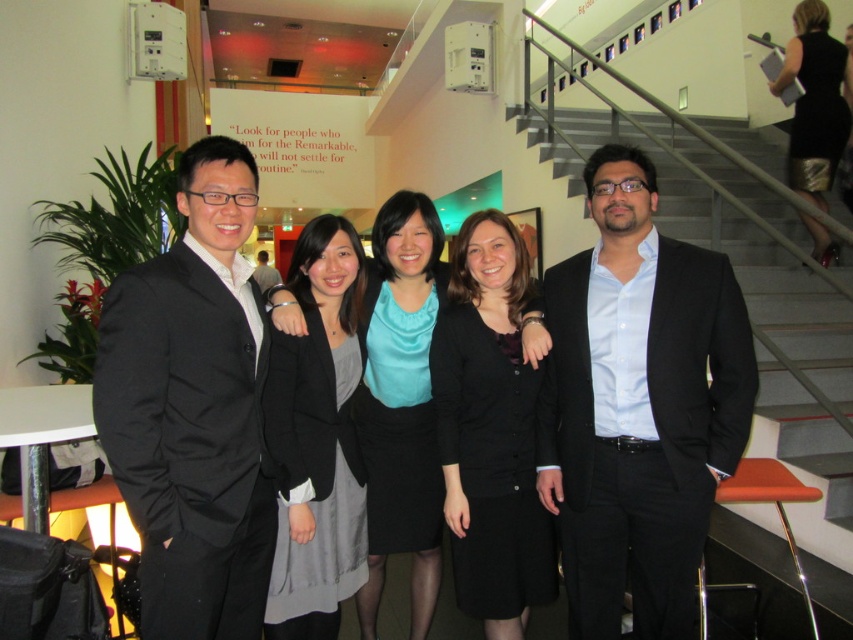
You are organizing a charity event and need to decide which of the two items, the black matte cardigan at center or the black suit at center, would be more appropriate for a volunteer to wear. Based on their sizes, which one is more likely to be a full outfit suitable for the event?

The black suit at center is larger in size compared to the black matte cardigan at center, making it more likely to be a full outfit suitable for the event.

You are organizing a photo shoot and need to ensure that the matte teal blouse at center and the black suit at center are both visible in the frame. Based on their sizes, which one might require more careful positioning to avoid being cropped out?

The matte teal blouse at center occupies less space than the black suit at center, so it might require more careful positioning to avoid being cropped out since it is smaller and could be easily missed if not framed properly.